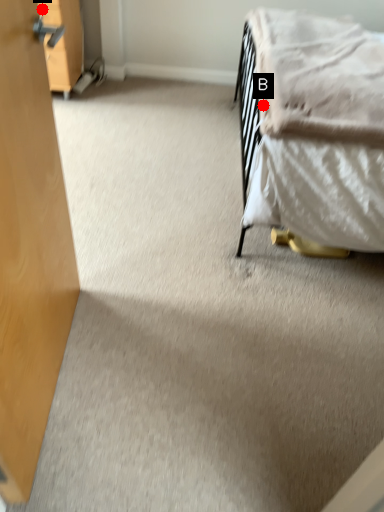
Question: Two points are circled on the image, labeled by A and B beside each circle. Which point appears closest to the camera in this image?

Choices:
 (A) A is closer
 (B) B is closer

Answer: (B)